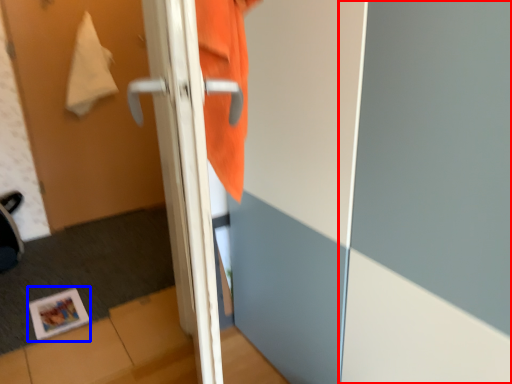
Question: Which point is closer to the camera, screen door (highlighted by a red box) or magazine (highlighted by a blue box)?

Choices:
 (A) screen door
 (B) magazine

Answer: (A)